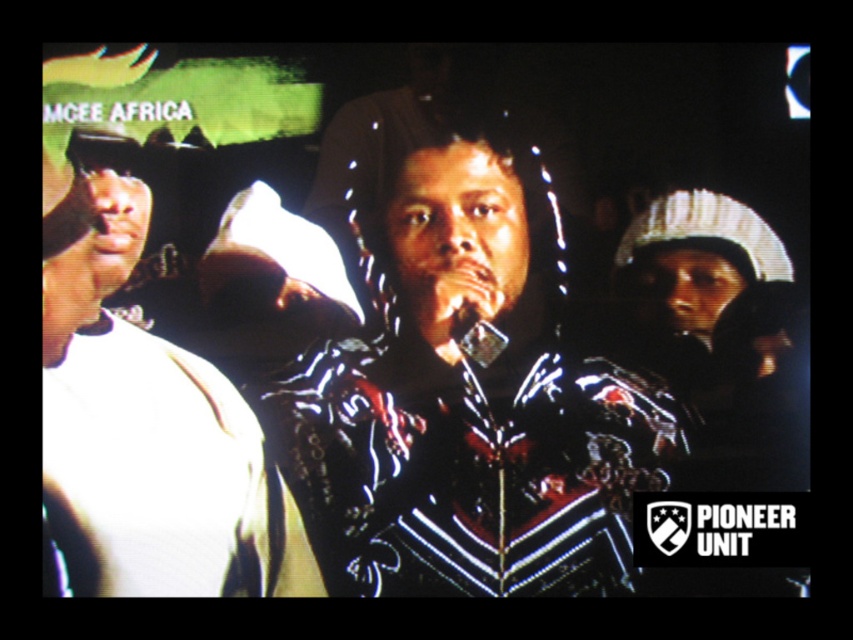
Does point (459, 397) come behind point (242, 529)?

Yes, it is.

Can you confirm if shiny black jacket at center is taller than white matte shirt at left?

Indeed, shiny black jacket at center has a greater height compared to white matte shirt at left.

What do you see at coordinates (457, 388) in the screenshot?
I see `shiny black jacket at center` at bounding box center [457, 388].

You are a GUI agent. You are given a task and a screenshot of the screen. Output one action in this format:
    pyautogui.click(x=<x>, y=<y>)
    Task: Click on the shiny black jacket at center
    The height and width of the screenshot is (640, 853).
    Given the screenshot: What is the action you would take?
    pyautogui.click(x=457, y=388)

What do you see at coordinates (148, 433) in the screenshot? The width and height of the screenshot is (853, 640). I see `white matte shirt at left` at bounding box center [148, 433].

Is the position of white matte shirt at left more distant than that of metallic silver microphone at center?

No, it is in front of metallic silver microphone at center.

What are the coordinates of `white matte shirt at left` in the screenshot? It's located at (148, 433).

Is point (340, 525) positioned in front of point (462, 346)?

That is True.

Based on the photo, who is more distant from viewer, (368, 106) or (471, 344)?

The point (471, 344) is more distant.

Is point (500, 532) behind point (483, 356)?

That is False.

At what (x,y) coordinates should I click in order to perform the action: click on shiny black jacket at center. Please return your answer as a coordinate pair (x, y). The image size is (853, 640). Looking at the image, I should click on (457, 388).